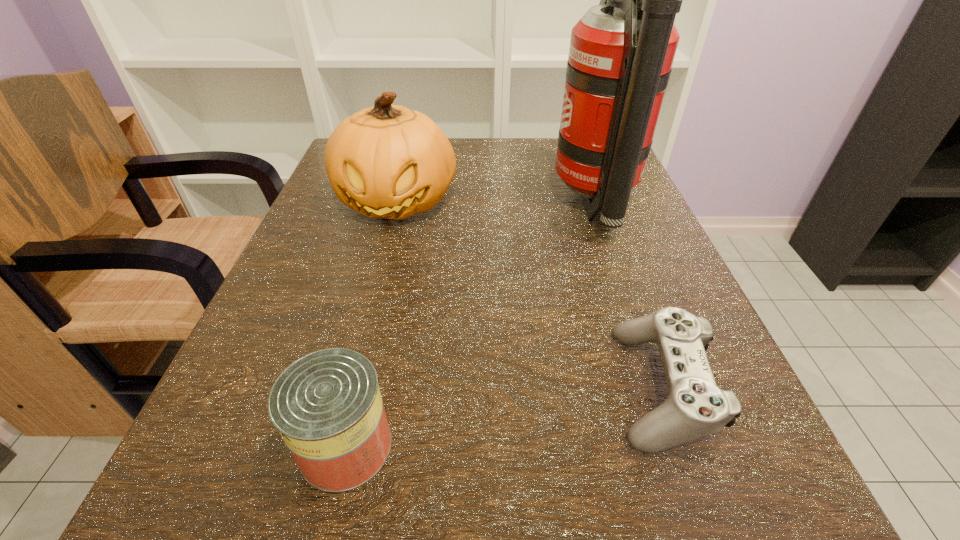
This screenshot has width=960, height=540. What are the coordinates of `vacant space at the far edge of the desktop` in the screenshot? It's located at (483, 153).

Where is `vacant space at the near edge`? vacant space at the near edge is located at coordinates (547, 525).

Locate an element on the screen. The height and width of the screenshot is (540, 960). vacant region at the left edge of the desktop is located at coordinates click(288, 354).

This screenshot has width=960, height=540. What are the coordinates of `vacant space at the right edge of the desktop` in the screenshot? It's located at coord(626,232).

Where is `free location at the near left corner`? free location at the near left corner is located at coordinates (319, 515).

This screenshot has width=960, height=540. Find the location of `vacant space at the far right corner of the desktop`. vacant space at the far right corner of the desktop is located at coordinates (558, 139).

Identify the location of free space between the fire extinguisher and the pumpkin. (495, 204).

The width and height of the screenshot is (960, 540). In order to click on vacant point located between the fire extinguisher and the third shortest object in this screenshot , I will do `click(495, 204)`.

At what (x,y) coordinates should I click in order to perform the action: click on unoccupied position between the second shortest object and the shortest object. Please return your answer as a coordinate pair (x, y). Image resolution: width=960 pixels, height=540 pixels. Looking at the image, I should click on (x=504, y=416).

Find the location of a particular element. free spot between the pumpkin and the fire extinguisher is located at coordinates (495, 204).